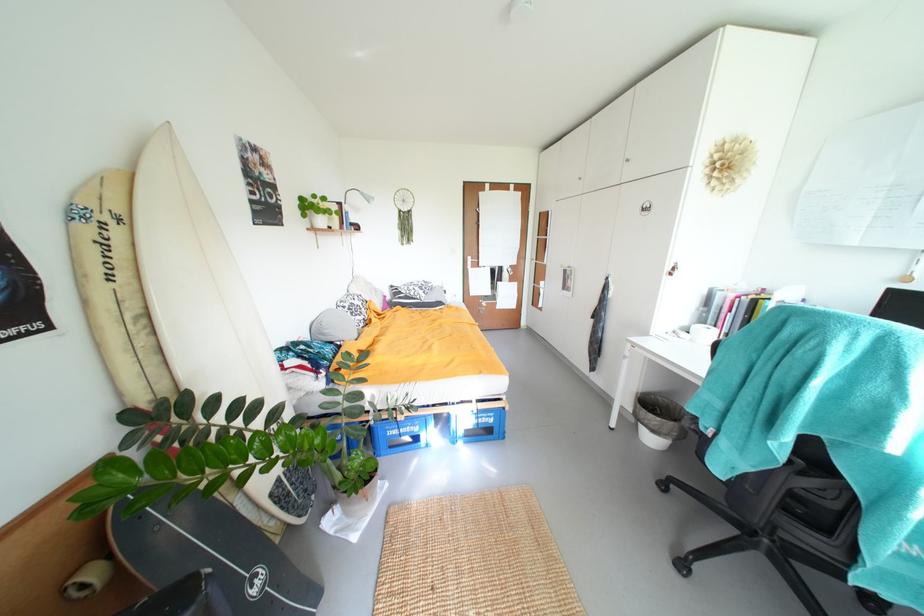
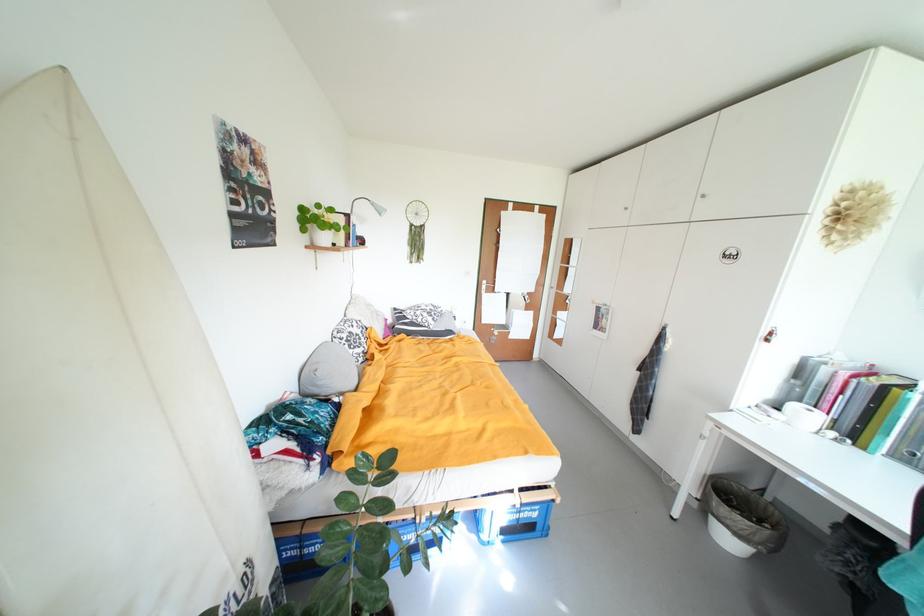
Locate, in the second image, the point that corresponds to (x=480, y=268) in the first image.

(494, 294)